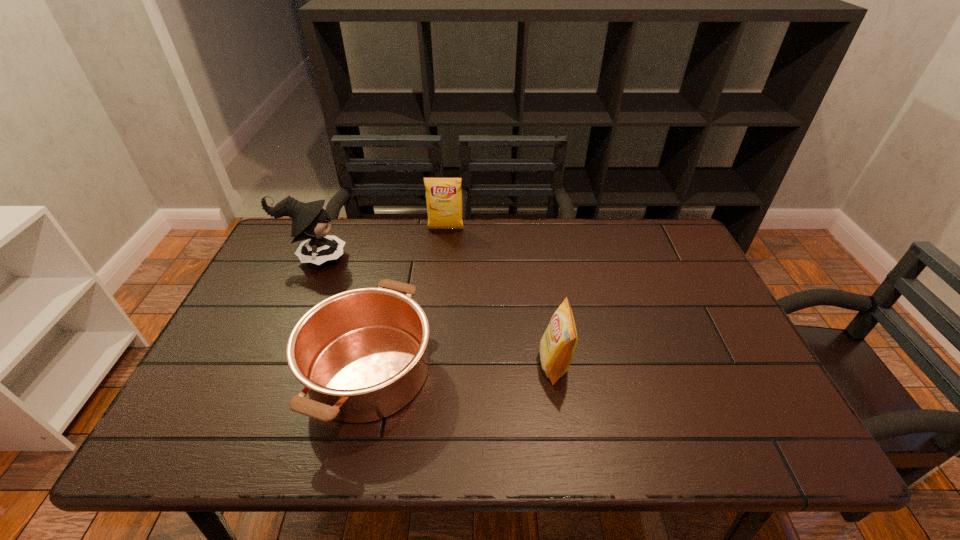
What are the coordinates of `vacant space at the far left corner` in the screenshot? It's located at tap(288, 247).

I want to click on blank space at the near left corner of the desktop, so click(210, 420).

What are the coordinates of `vacant space that is in between the second farthest object and the left crisp (potato chip)` in the screenshot? It's located at (380, 244).

Locate an element on the screen. The height and width of the screenshot is (540, 960). vacant area between the doll and the farther crisp (potato chip) is located at coordinates (380, 244).

Locate an element on the screen. The image size is (960, 540). empty space that is in between the left crisp (potato chip) and the rightmost object is located at coordinates (500, 296).

Locate an element on the screen. The height and width of the screenshot is (540, 960). free spot between the nearer crisp (potato chip) and the saucepan is located at coordinates (462, 368).

This screenshot has width=960, height=540. In order to click on free spot between the nearer crisp (potato chip) and the doll in this screenshot , I will do `click(434, 311)`.

The image size is (960, 540). I want to click on free space between the farther crisp (potato chip) and the nearer crisp (potato chip), so click(500, 296).

Locate which object ranks third in proximity to the right crisp (potato chip). Please provide its 2D coordinates. Your answer should be formatted as a tuple, i.e. [(x, y)], where the tuple contains the x and y coordinates of a point satisfying the conditions above.

[(310, 221)]

Where is `object that ranks as the second closest to the saucepan`? The image size is (960, 540). object that ranks as the second closest to the saucepan is located at coordinates (557, 346).